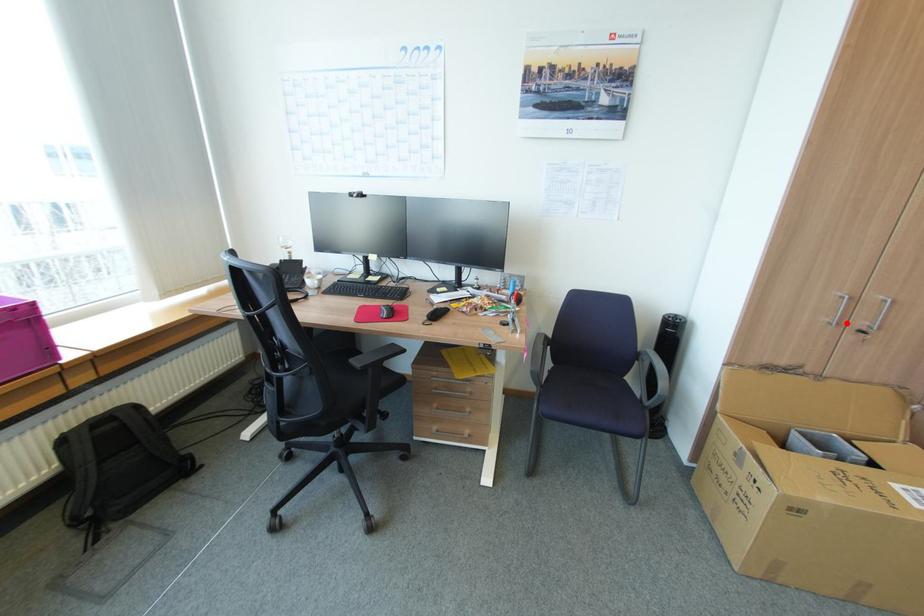
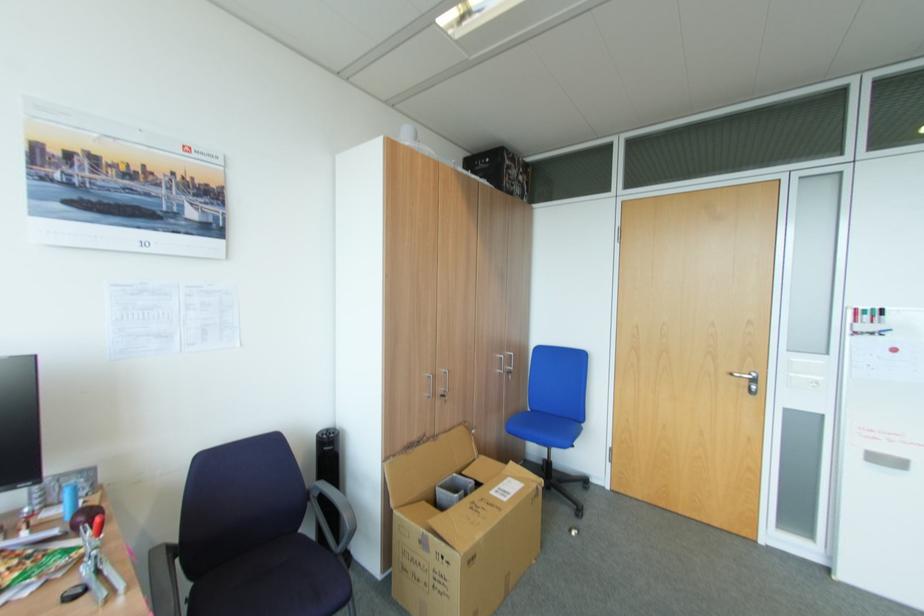
Question: I am providing you with two images of the same scene from different viewpoints. Given a red point in image1, look at the same physical point in image2. Is it:

Choices:
 (A) Closer to the viewpoint
 (B) Farther from the viewpoint

Answer: (B)